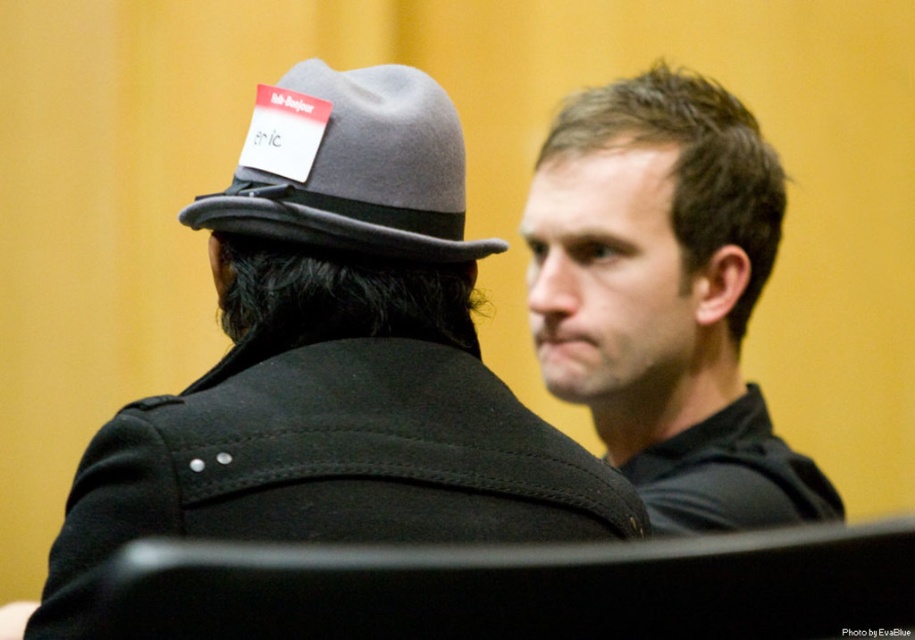
You are a photographer setting up for a portrait session. You need to adjust the lighting so that both the brown matte hair at upper right and the gray felt fedora at upper left are evenly illuminated. Given their height difference, which object should you raise the light stand closer to?

The brown matte hair at upper right is much taller than the gray felt fedora at upper left, so you should raise the light stand closer to the brown matte hair at upper right to ensure even illumination.

You are a photographer adjusting the lighting for a portrait session. You need to ensure that the brown matte hair at upper right and the gray felt fedora at upper left are both well illuminated. Which object requires a wider light source to accommodate its size?

The brown matte hair at upper right requires a wider light source because it is bigger than the gray felt fedora at upper left.